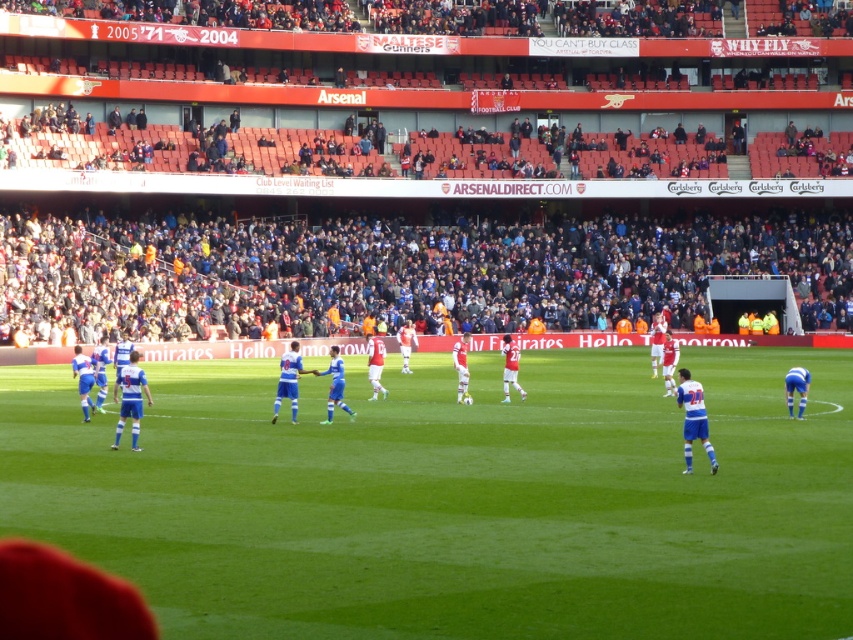
You are a drone operator trying to capture a wide shot of the green grass football field at center and the blue jersey at center. Which object would appear wider in the photo?

The blue jersey at center would appear wider in the photo because its width is greater than the green grass football field at center according to the description.